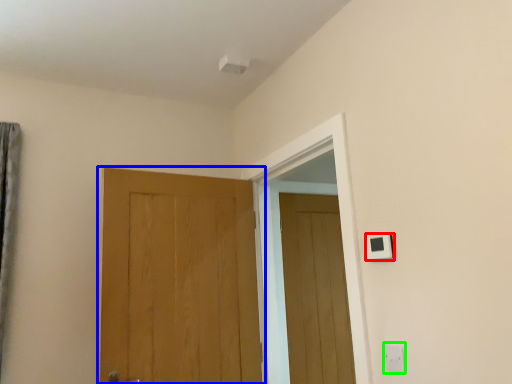
Question: Which object is positioned closest to light switch (highlighted by a red box)? Select from door (highlighted by a blue box) and electric outlet (highlighted by a green box).

Choices:
 (A) door
 (B) electric outlet

Answer: (B)